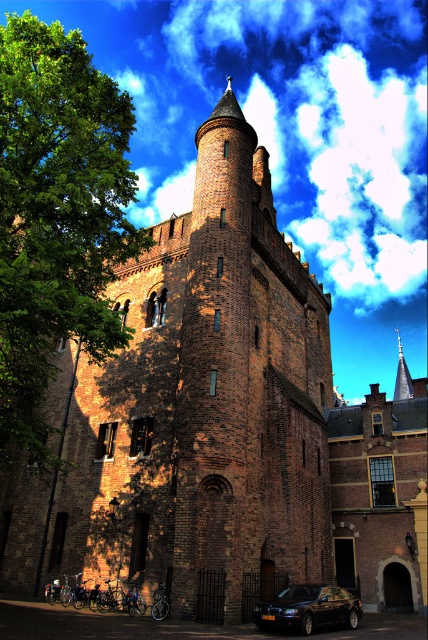
Question: Does green leafy tree at left have a lesser width compared to shiny black car at lower center?

Choices:
 (A) no
 (B) yes

Answer: (A)

Question: Which object appears farthest from the camera in this image?

Choices:
 (A) green leafy tree at left
 (B) shiny black car at lower center

Answer: (B)

Question: In this image, where is green leafy tree at left located relative to shiny black car at lower center?

Choices:
 (A) left
 (B) right

Answer: (A)

Question: Is green leafy tree at left wider than shiny black car at lower center?

Choices:
 (A) yes
 (B) no

Answer: (A)

Question: Which point is farther to the camera?

Choices:
 (A) shiny black car at lower center
 (B) green leafy tree at left

Answer: (A)

Question: Which of the following is the farthest from the observer?

Choices:
 (A) (278, 605)
 (B) (115, 120)

Answer: (B)